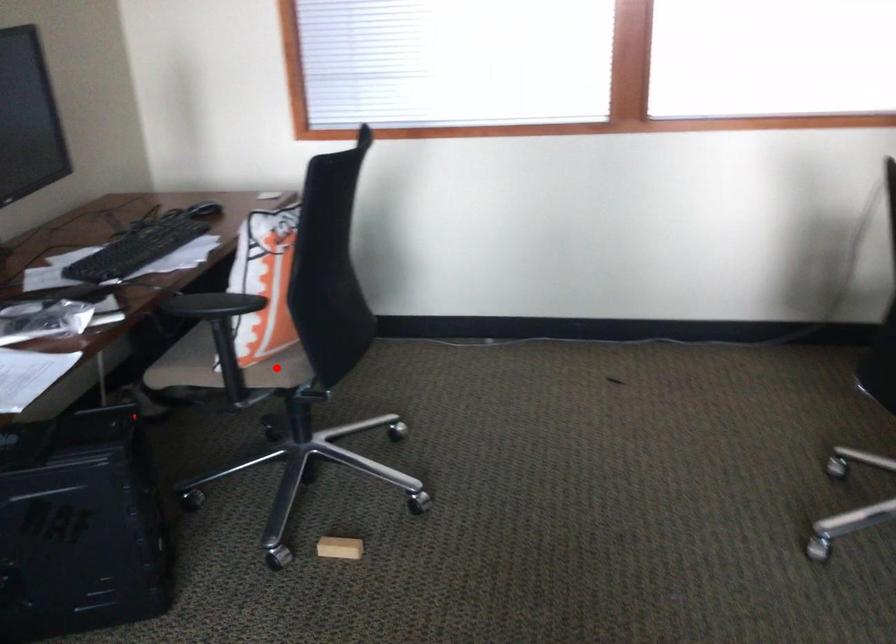
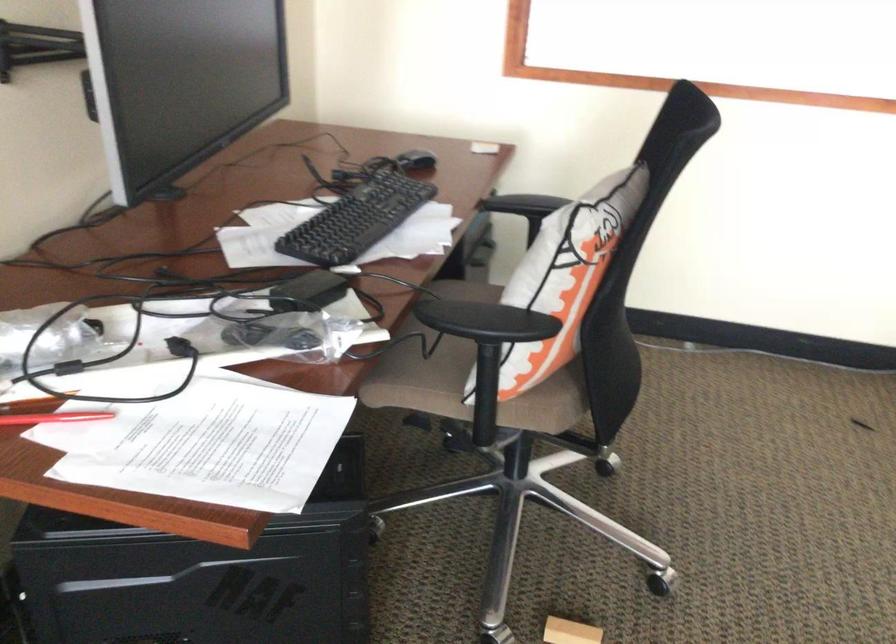
Where in the second image is the point corresponding to the highlighted location from the first image?

(543, 408)